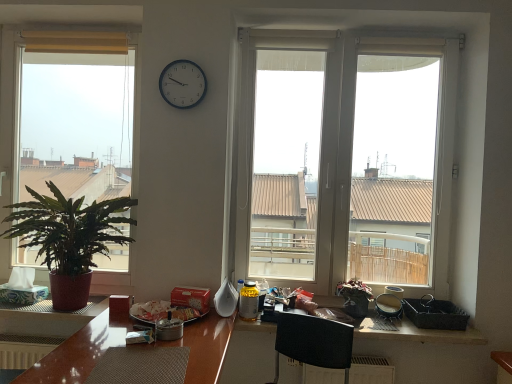
Image resolution: width=512 pixels, height=384 pixels. What do you see at coordinates (182, 84) in the screenshot?
I see `metallic clock at upper center` at bounding box center [182, 84].

Describe the element at coordinates (417, 333) in the screenshot. I see `wooden textured counter top at lower center` at that location.

What do you see at coordinates (355, 297) in the screenshot? The width and height of the screenshot is (512, 384). I see `green matte plant at center, marked as the 1th houseplant in a right-to-left arrangement` at bounding box center [355, 297].

The height and width of the screenshot is (384, 512). What do you see at coordinates (249, 301) in the screenshot? I see `yellow plastic bottle at center` at bounding box center [249, 301].

This screenshot has width=512, height=384. What do you see at coordinates (76, 114) in the screenshot? I see `green matte plant at left, which appears as the 1th window when viewed from the left` at bounding box center [76, 114].

Describe the element at coordinates (347, 161) in the screenshot. This screenshot has height=384, width=512. I see `white plastic window at center, positioned as the 1th window in right-to-left order` at that location.

I want to click on metallic clock at upper center, so click(182, 84).

Would you say white plastic window at center, the second window when ordered from left to right, is to the left or to the right of green matte plant at left, the first houseplant positioned from the left, in the picture?

Clearly, white plastic window at center, the second window when ordered from left to right, is on the right of green matte plant at left, the first houseplant positioned from the left, in the image.

Can you confirm if white plastic window at center, positioned as the 1th window in right-to-left order, is smaller than green matte plant at left, the first houseplant positioned from the left?

No.

Does white plastic window at center, positioned as the 1th window in right-to-left order, lie in front of green matte plant at left, which is the 2th houseplant from right to left?

No.

Choose the correct answer: Is white plastic window at center, the second window when ordered from left to right, inside green matte plant at left, the first houseplant positioned from the left, or outside it?

white plastic window at center, the second window when ordered from left to right, is spatially situated outside green matte plant at left, the first houseplant positioned from the left.

Between point (188, 61) and point (251, 289), which one is positioned behind?

The point (251, 289) is farther.

Considering the relative sizes of metallic clock at upper center and yellow plastic bottle at center in the image provided, is metallic clock at upper center smaller than yellow plastic bottle at center?

Actually, metallic clock at upper center might be larger than yellow plastic bottle at center.

Is metallic clock at upper center situated inside yellow plastic bottle at center or outside?

metallic clock at upper center exists outside the volume of yellow plastic bottle at center.

How many degrees apart are the facing directions of metallic clock at upper center and yellow plastic bottle at center?

The facing directions of metallic clock at upper center and yellow plastic bottle at center are 6.85 degrees apart.

Which is behind, black plastic picnic basket at lower right or white matte tissue at left?

white matte tissue at left is further away from the camera.

Between point (428, 321) and point (3, 287), which one is positioned behind?

Point (3, 287)

Could you tell me if black plastic picnic basket at lower right is turned towards white matte tissue at left?

Yes, black plastic picnic basket at lower right faces towards white matte tissue at left.

Considering the sizes of objects black plastic picnic basket at lower right and white matte tissue at left in the image provided, who is shorter, black plastic picnic basket at lower right or white matte tissue at left?

black plastic picnic basket at lower right is shorter.

Considering the relative positions of green matte plant at left, acting as the 2th window starting from the right, and white plastic window at center, the second window when ordered from left to right, in the image provided, is green matte plant at left, acting as the 2th window starting from the right, to the left of white plastic window at center, the second window when ordered from left to right, from the viewer's perspective?

Indeed, green matte plant at left, acting as the 2th window starting from the right, is positioned on the left side of white plastic window at center, the second window when ordered from left to right.

From the image's perspective, is green matte plant at left, acting as the 2th window starting from the right, above or below white plastic window at center, the second window when ordered from left to right?

green matte plant at left, acting as the 2th window starting from the right, is above white plastic window at center, the second window when ordered from left to right.

In terms of size, does green matte plant at left, which appears as the 1th window when viewed from the left, appear bigger or smaller than white plastic window at center, the second window when ordered from left to right?

green matte plant at left, which appears as the 1th window when viewed from the left, is smaller than white plastic window at center, the second window when ordered from left to right.

Considering the sizes of objects green matte plant at left, which appears as the 1th window when viewed from the left, and white plastic window at center, the second window when ordered from left to right, in the image provided, who is shorter, green matte plant at left, which appears as the 1th window when viewed from the left, or white plastic window at center, the second window when ordered from left to right,?

white plastic window at center, the second window when ordered from left to right, is shorter.

Is matte yellow curtain at upper left at the back of black plastic picnic basket at lower right?

No, black plastic picnic basket at lower right is not facing away from matte yellow curtain at upper left.

Locate an element on the screen. curtain located above the black plastic picnic basket at lower right (from a real-world perspective) is located at coordinates (77, 42).

From a real-world perspective, is black plastic picnic basket at lower right beneath matte yellow curtain at upper left?

Indeed, from a real-world perspective, black plastic picnic basket at lower right is positioned beneath matte yellow curtain at upper left.

What's the angular difference between wooden textured counter top at lower center and metallic clock at upper center's facing directions?

The angle between the facing direction of wooden textured counter top at lower center and the facing direction of metallic clock at upper center is 0.000161 degrees.

From the image's perspective, is wooden textured counter top at lower center above or below metallic clock at upper center?

wooden textured counter top at lower center is situated lower than metallic clock at upper center in the image.

Can you confirm if wooden textured counter top at lower center is bigger than metallic clock at upper center?

Yes, wooden textured counter top at lower center is bigger than metallic clock at upper center.

Is wooden textured counter top at lower center in contact with metallic clock at upper center?

No, wooden textured counter top at lower center is not with metallic clock at upper center.

What's the angular difference between green matte plant at left, which is the 2th houseplant from right to left, and white matte tissue at left's facing directions?

3.87e-05 degrees.

Who is shorter, green matte plant at left, which is the 2th houseplant from right to left, or white matte tissue at left?

white matte tissue at left.

From a real-world perspective, is green matte plant at left, which is the 2th houseplant from right to left, physically above white matte tissue at left?

Yes, from a real-world perspective, green matte plant at left, which is the 2th houseplant from right to left, is above white matte tissue at left.

From the picture: Which point is more forward, (70, 239) or (32, 270)?

The point (70, 239) is closer.

In order to click on window on the right side of green matte plant at left, which is the 2th houseplant from right to left in this screenshot , I will do `click(347, 161)`.

Image resolution: width=512 pixels, height=384 pixels. What are the coordinates of `bottle below the metallic clock at upper center (from the image's perspective)` in the screenshot? It's located at (249, 301).

From the image, which object appears to be farther from green matte plant at left, acting as the 2th window starting from the right, green matte plant at center, marked as the 1th houseplant in a right-to-left arrangement, or green matte plant at left, which is the 2th houseplant from right to left?

green matte plant at center, marked as the 1th houseplant in a right-to-left arrangement, is positioned further to the anchor green matte plant at left, acting as the 2th window starting from the right.

Based on their spatial positions, is white matte tissue at left or green matte plant at left, the first houseplant positioned from the left, further from green matte plant at center, marked as the 1th houseplant in a right-to-left arrangement?

white matte tissue at left is positioned further to the anchor green matte plant at center, marked as the 1th houseplant in a right-to-left arrangement.

In the scene shown: Based on their spatial positions, is black plastic picnic basket at lower right or white plastic window at center, positioned as the 1th window in right-to-left order, closer to green matte plant at left, acting as the 2th window starting from the right?

black plastic picnic basket at lower right is closer to green matte plant at left, acting as the 2th window starting from the right.

From the image, which object appears to be farther from white plastic window at center, positioned as the 1th window in right-to-left order, wooden textured counter top at lower center or green matte plant at left, the first houseplant positioned from the left?

Based on the image, green matte plant at left, the first houseplant positioned from the left, appears to be further to white plastic window at center, positioned as the 1th window in right-to-left order.

Which object lies further to the anchor point metallic clock at upper center, matte yellow curtain at upper left or green matte plant at center, marked as the 1th houseplant in a right-to-left arrangement?

green matte plant at center, marked as the 1th houseplant in a right-to-left arrangement.

Based on their spatial positions, is white matte tissue at left or green matte plant at left, the first houseplant positioned from the left, closer to white plastic window at center, the second window when ordered from left to right?

green matte plant at left, the first houseplant positioned from the left, lies closer to white plastic window at center, the second window when ordered from left to right, than the other object.

Estimate the real-world distances between objects in this image. Which object is closer to yellow plastic bottle at center, matte yellow curtain at upper left or white matte tissue at left?

Based on the image, white matte tissue at left appears to be nearer to yellow plastic bottle at center.

From the image, which object appears to be nearer to green matte plant at center, marked as the 1th houseplant in a right-to-left arrangement, green matte plant at left, acting as the 2th window starting from the right, or black plastic picnic basket at lower right?

The object closer to green matte plant at center, marked as the 1th houseplant in a right-to-left arrangement, is black plastic picnic basket at lower right.

In order to click on picnic basket between white plastic window at center, the second window when ordered from left to right, and wooden textured counter top at lower center in the up-down direction in this screenshot , I will do `click(435, 314)`.

At what (x,y) coordinates should I click in order to perform the action: click on curtain situated between green matte plant at left, acting as the 2th window starting from the right, and white plastic window at center, positioned as the 1th window in right-to-left order, from left to right. Please return your answer as a coordinate pair (x, y). Image resolution: width=512 pixels, height=384 pixels. Looking at the image, I should click on (77, 42).

This screenshot has width=512, height=384. I want to click on clock located between white matte tissue at left and green matte plant at center, marked as the 1th houseplant in a right-to-left arrangement, in the left-right direction, so click(x=182, y=84).

At what (x,y) coordinates should I click in order to perform the action: click on houseplant between wooden textured counter top at lower center and black plastic picnic basket at lower right from left to right. Please return your answer as a coordinate pair (x, y). This screenshot has width=512, height=384. Looking at the image, I should click on (355, 297).